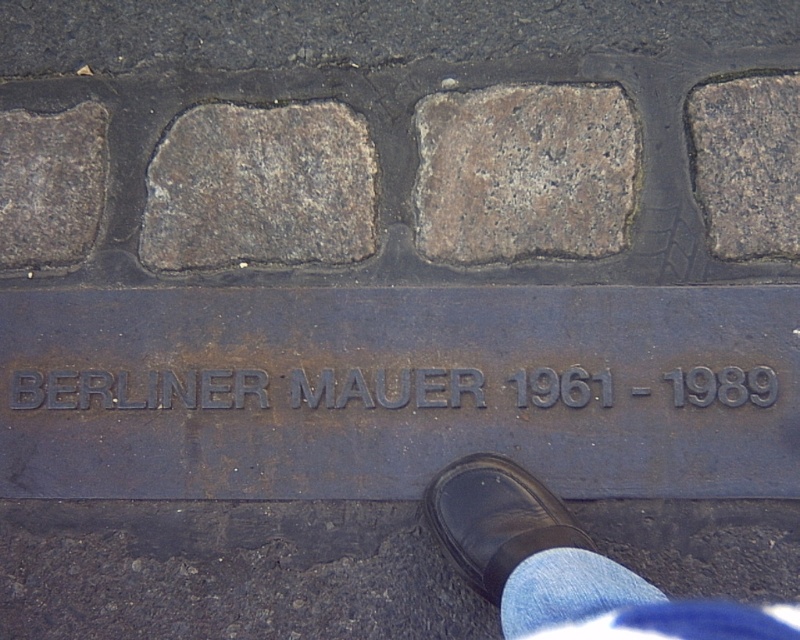
Who is higher up, black embossed text at center or dark gray stone at left?

Positioned higher is dark gray stone at left.

Is point (524, 381) positioned after point (61, 157)?

No, it is not.

This screenshot has height=640, width=800. In order to click on black embossed text at center in this screenshot , I will do `click(144, 392)`.

Does point (462, 474) come behind point (96, 204)?

No, (462, 474) is in front of (96, 204).

Based on the photo, is the position of black leather shoe at lower right more distant than that of dark gray stone at left?

No.

I want to click on black leather shoe at lower right, so click(524, 547).

This screenshot has height=640, width=800. I want to click on black leather shoe at lower right, so click(x=524, y=547).

Is point (514, 120) positioned behind point (96, 372)?

Yes.

Based on the photo, is brown rough stone at center taller than black embossed text at center?

Yes, brown rough stone at center is taller than black embossed text at center.

The width and height of the screenshot is (800, 640). In order to click on brown rough stone at center in this screenshot , I will do point(524,172).